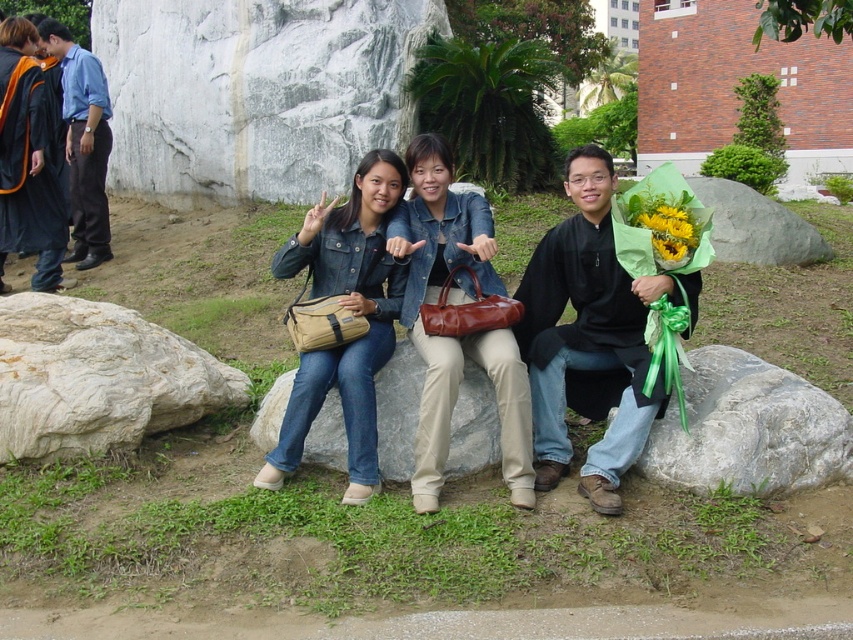
Which is more to the right, gray rough rock at lower left or yellow paper flower at center?

yellow paper flower at center

Which of these two, gray rough rock at lower left or yellow paper flower at center, stands shorter?

yellow paper flower at center is shorter.

Who is more forward, (28,440) or (662,204)?

Point (28,440) is more forward.

Image resolution: width=853 pixels, height=640 pixels. Find the location of `gray rough rock at lower left`. gray rough rock at lower left is located at coordinates (97, 378).

Between matte black jacket at center and yellow paper flower at center, which one has less height?

Standing shorter between the two is yellow paper flower at center.

Does matte black jacket at center appear over yellow paper flower at center?

Incorrect, matte black jacket at center is not positioned above yellow paper flower at center.

The image size is (853, 640). Describe the element at coordinates (347, 308) in the screenshot. I see `matte black jacket at center` at that location.

Where is `matte black jacket at center`? The height and width of the screenshot is (640, 853). matte black jacket at center is located at coordinates (347, 308).

Is the position of matte black jacket at center more distant than that of blue jeans at center?

No, matte black jacket at center is closer to the viewer.

Is matte black jacket at center to the right of blue jeans at center from the viewer's perspective?

No, matte black jacket at center is not to the right of blue jeans at center.

Which is behind, point (373, 323) or point (477, 444)?

Positioned behind is point (373, 323).

Image resolution: width=853 pixels, height=640 pixels. What are the coordinates of `matte black jacket at center` in the screenshot? It's located at (347, 308).